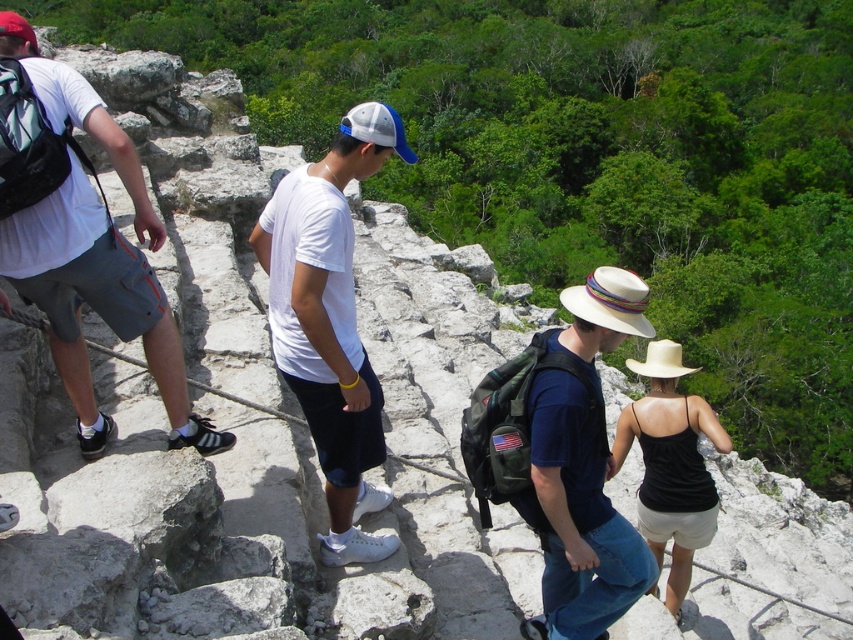
Is white t-shirt at left below white matte t-shirt at center?

Actually, white t-shirt at left is above white matte t-shirt at center.

Can you confirm if white t-shirt at left is shorter than white matte t-shirt at center?

No, white t-shirt at left is not shorter than white matte t-shirt at center.

This screenshot has height=640, width=853. What do you see at coordinates (82, 237) in the screenshot?
I see `white t-shirt at left` at bounding box center [82, 237].

You are a GUI agent. You are given a task and a screenshot of the screen. Output one action in this format:
    pyautogui.click(x=<x>, y=<y>)
    Task: Click on the white t-shirt at left
    This screenshot has height=640, width=853.
    Given the screenshot: What is the action you would take?
    click(x=82, y=237)